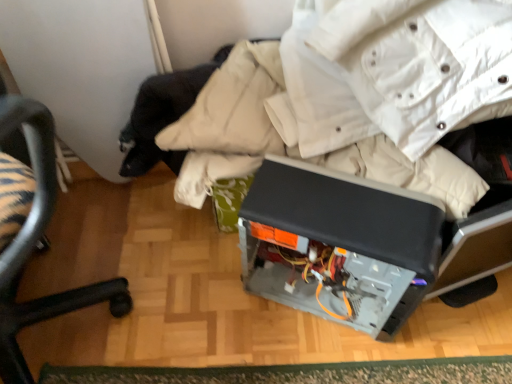
Question: Is point (34, 233) positioned closer to the camera than point (490, 362)?

Choices:
 (A) closer
 (B) farther

Answer: (A)

Question: Is black plastic chair at lower left bigger or smaller than green textured mat at lower center?

Choices:
 (A) small
 (B) big

Answer: (B)

Question: Which is farther from the black plastic chair at lower left?

Choices:
 (A) green textured mat at lower center
 (B) satin black computer case at center

Answer: (B)

Question: Which object is positioned closest to the black plastic chair at lower left?

Choices:
 (A) green textured mat at lower center
 (B) satin black computer case at center

Answer: (A)